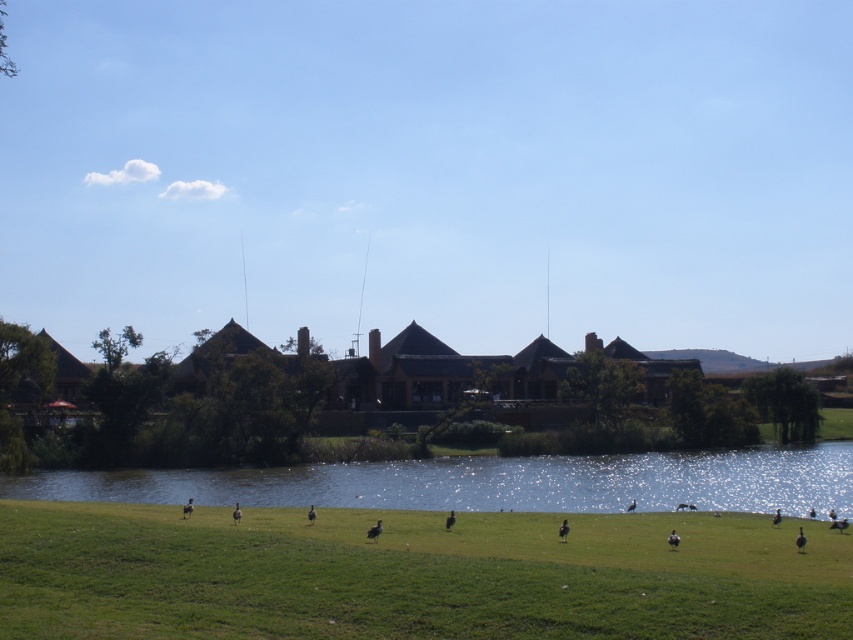
You are standing at the point marked as point (412,573) in the image. Looking around, what type of terrain do you feel under your feet?

The point (412,573) is on the green grassy field at lower center, so you would feel grass under your feet.

You are a landscape architect designing a new pathway. You need to decide whether to place it on the green grassy field at lower center or the blue reflective water at center. Based on their heights, which surface is more suitable for a pathway?

The green grassy field at lower center has a lesser height compared to the blue reflective water at center, so it is more suitable for a pathway since lower elevation areas are typically easier to construct on.